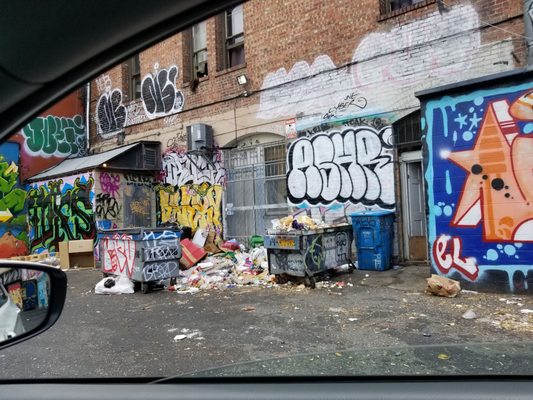
In order to click on open white door in this screenshot , I will do `click(413, 208)`.